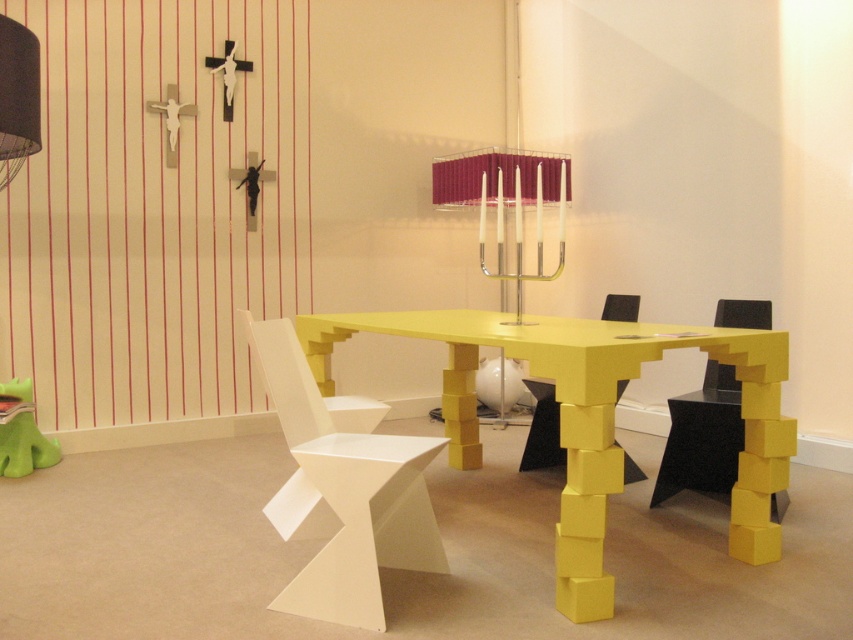
Question: Does white matte chair at center appear on the right side of matte white chair at center?

Choices:
 (A) no
 (B) yes

Answer: (A)

Question: Which of these objects is positioned closest to the yellow matte table at center?

Choices:
 (A) white matte chair at center
 (B) yellow matte chair at lower right

Answer: (A)

Question: Where is white matte chair at center located in relation to matte white chair at center in the image?

Choices:
 (A) left
 (B) right

Answer: (A)

Question: Is yellow matte table at center bigger than matte white chair at center?

Choices:
 (A) no
 (B) yes

Answer: (B)

Question: Considering the real-world distances, which object is farthest from the matte white chair at center?

Choices:
 (A) yellow matte table at center
 (B) yellow matte chair at lower right

Answer: (A)

Question: Which object appears closest to the camera in this image?

Choices:
 (A) yellow matte chair at lower right
 (B) yellow matte table at center
 (C) white matte chair at center

Answer: (B)